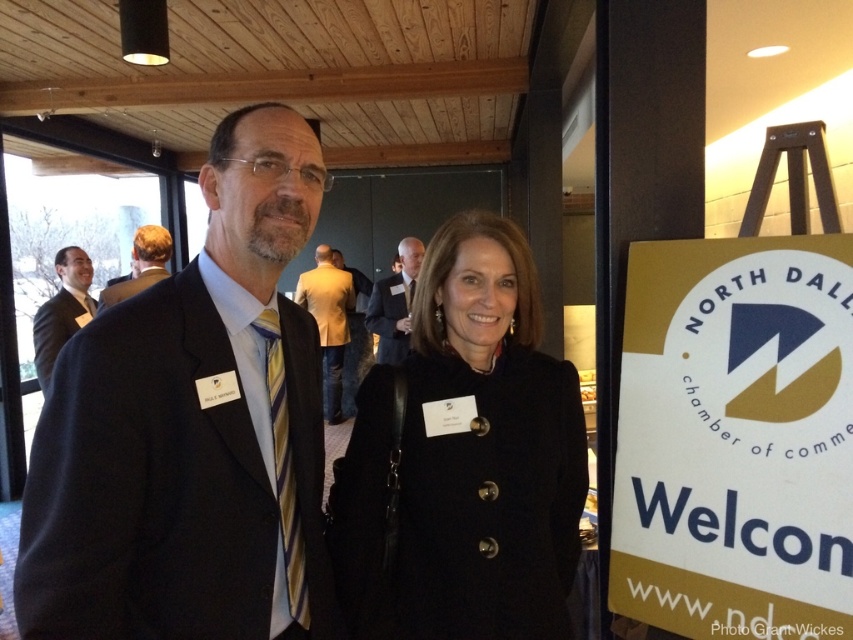
Measure the distance between point (726, 349) and camera.

Point (726, 349) and camera are 1.30 meters apart.

Can you confirm if white paper sign at right is positioned to the right of golden textured blazer at center?

Yes, white paper sign at right is to the right of golden textured blazer at center.

Measure the distance between white paper sign at right and camera.

3.67 feet

Where is `white paper sign at right`? This screenshot has width=853, height=640. white paper sign at right is located at coordinates (735, 438).

Is point (437, 584) less distant than point (355, 339)?

Yes, point (437, 584) is in front of point (355, 339).

Is black wool coat at center closer to camera compared to golden leather jacket at center?

That is True.

Is point (508, 433) less distant than point (349, 378)?

That is True.

You are a GUI agent. You are given a task and a screenshot of the screen. Output one action in this format:
    pyautogui.click(x=<x>, y=<y>)
    Task: Click on the black wool coat at center
    This screenshot has width=853, height=640.
    Given the screenshot: What is the action you would take?
    pyautogui.click(x=463, y=460)

Who is higher up, matte black suit at left or light brown hair at upper left?

light brown hair at upper left is higher up.

Describe the element at coordinates (62, 310) in the screenshot. The height and width of the screenshot is (640, 853). I see `matte black suit at left` at that location.

In order to click on matte black suit at left in this screenshot , I will do `click(62, 310)`.